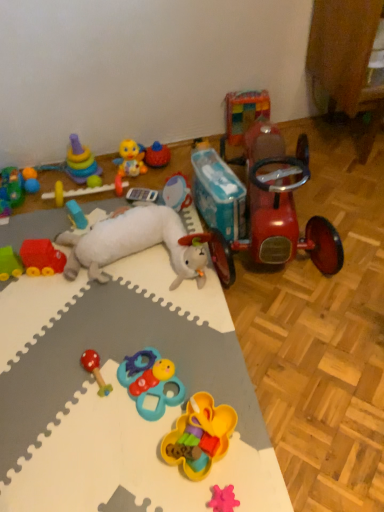
Find the location of a particular element. free space between rubberized yellow flower-shaped toy at center, the tenth toy in the left-to-right sequence, and white plush toy at center, the seventh toy when ordered from left to right is located at coordinates (160, 333).